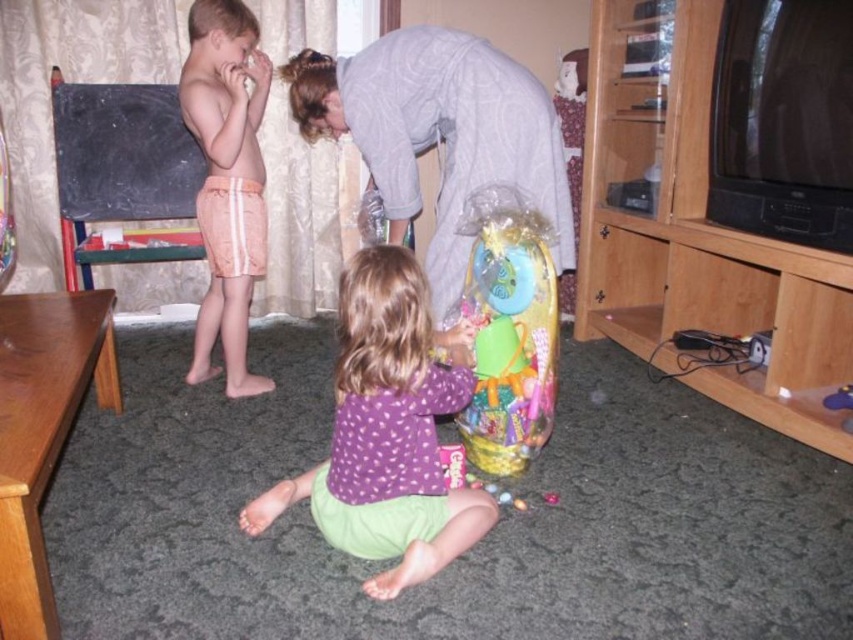
Question: Where is pink striped shorts at left located in relation to translucent plastic basket at center in the image?

Choices:
 (A) right
 (B) left

Answer: (B)

Question: Among these objects, which one is nearest to the camera?

Choices:
 (A) purple fabric shirt at center
 (B) gray cotton shirt at upper center
 (C) translucent plastic basket at center

Answer: (A)

Question: Where is gray cotton shirt at upper center located in relation to pink striped shorts at left in the image?

Choices:
 (A) above
 (B) below

Answer: (A)

Question: Among these objects, which one is nearest to the camera?

Choices:
 (A) pink striped shorts at left
 (B) gray cotton shirt at upper center
 (C) purple fabric shirt at center

Answer: (C)

Question: Is purple fabric shirt at center to the left of pink striped shorts at left from the viewer's perspective?

Choices:
 (A) yes
 (B) no

Answer: (B)

Question: Estimate the real-world distances between objects in this image. Which object is farther from the purple fabric shirt at center?

Choices:
 (A) gray cotton shirt at upper center
 (B) translucent plastic basket at center

Answer: (A)